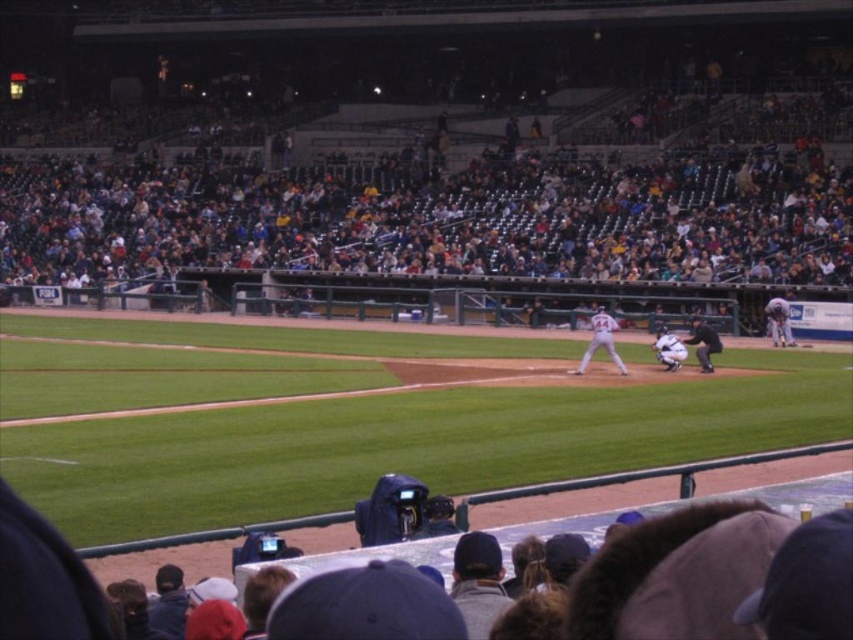
You are a photographer standing at the edge of the baseball field. You want to take a photo that includes both the white uniform player at center and the white matte uniform at center. Based on their positions, which player should you pan your camera to the right to capture first?

The white uniform player at center is positioned on the left side of the white matte uniform at center, so you should pan your camera to the right to first capture the white uniform player at center before the white matte uniform at center comes into frame.

You are a photographer standing at the edge of the baseball field. You want to take a photo of the white uniform at center and the white matte uniform at center. Which one is positioned higher in the image?

The white uniform at center is positioned higher in the image than the white matte uniform at center because it is located above it.